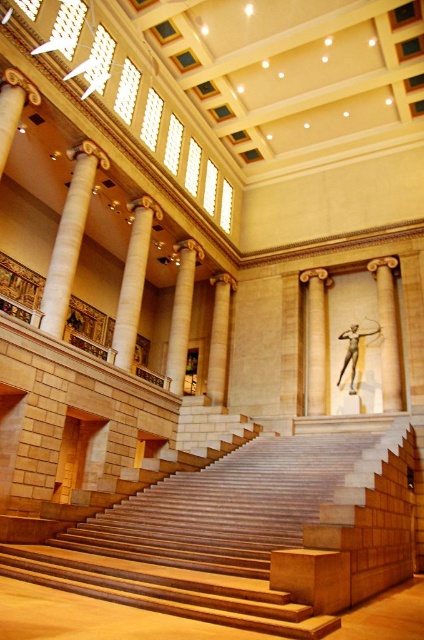
Does white marble pillar at center appear under beige marble column at center?

Correct, white marble pillar at center is located below beige marble column at center.

Is white marble pillar at center taller than beige marble column at center?

In fact, white marble pillar at center may be shorter than beige marble column at center.

Which is behind, point (381, 332) or point (183, 296)?

The point (183, 296) is more distant.

Locate an element on the screen. Image resolution: width=424 pixels, height=640 pixels. white marble pillar at center is located at coordinates (388, 333).

Who is taller, white marble column at center or bronze statue at center?

Standing taller between the two is white marble column at center.

The width and height of the screenshot is (424, 640). Find the location of `white marble column at center`. white marble column at center is located at coordinates (69, 237).

Image resolution: width=424 pixels, height=640 pixels. What are the coordinates of `white marble column at center` in the screenshot? It's located at (69, 237).

Is the position of wooden stairs at center more distant than that of beige marble column at center?

No, it is not.

Is wooden stairs at center positioned before beige marble column at center?

Yes, it is.

This screenshot has height=640, width=424. I want to click on wooden stairs at center, so click(226, 547).

Locate an element on the screen. Image resolution: width=424 pixels, height=640 pixels. wooden stairs at center is located at coordinates (226, 547).